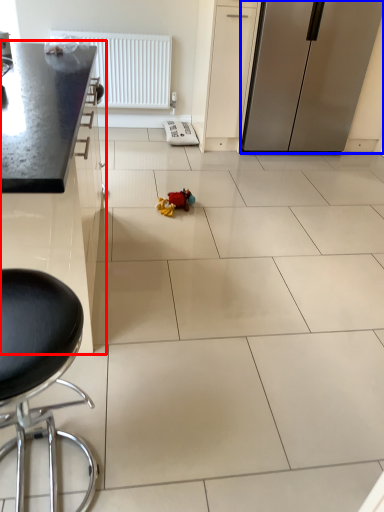
Question: Which point is closer to the camera, cabinetry (highlighted by a red box) or refrigerator (highlighted by a blue box)?

Choices:
 (A) cabinetry
 (B) refrigerator

Answer: (A)